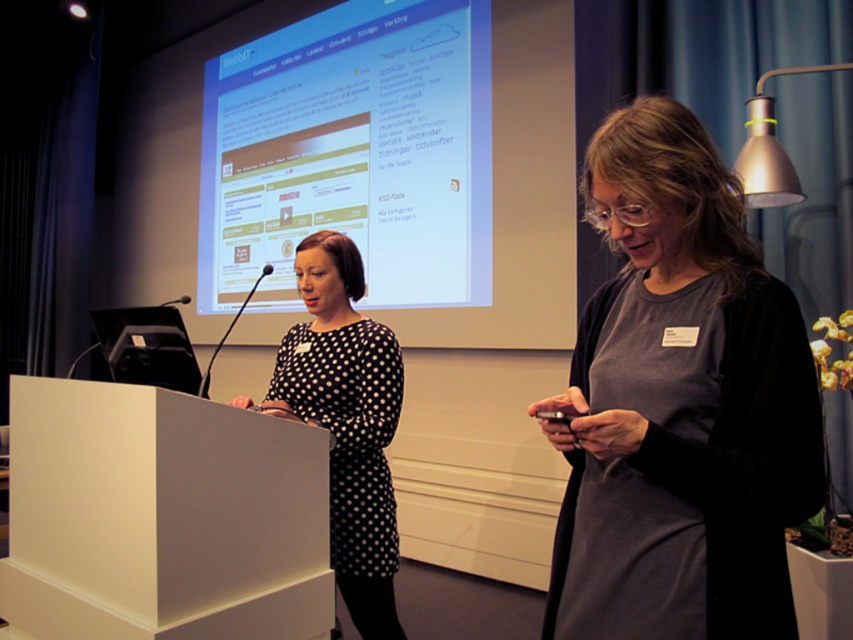
You are a speaker who needs to reach the white matte podium at lower left from your current position near the black dotted dress at center. Can you walk directly to it without moving any objects?

The distance between the white matte podium at lower left and black dotted dress at center is 35.93 centimeters, so yes, you can walk directly to the white matte podium at lower left without needing to move any objects since the space is sufficient for movement.

You are organizing a presentation in this room and need to ensure that the presenter can easily access the podium while facing the projection screen. Given the distance between the white glossy projection screen at upper center and the white matte podium at lower left, is the space sufficient for the presenter to comfortably move between them without feeling cramped?

The distance between the white glossy projection screen at upper center and the white matte podium at lower left is 8.91 feet, which provides ample space for the presenter to move comfortably between them without feeling cramped.